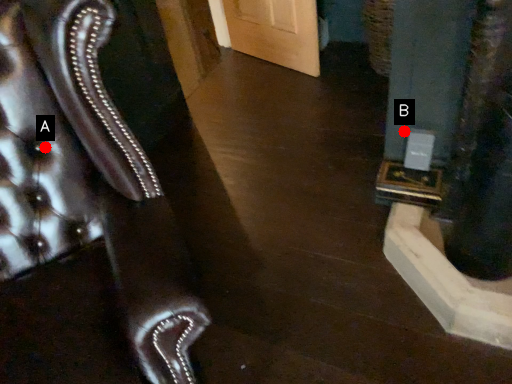
Question: Two points are circled on the image, labeled by A and B beside each circle. Among these points, which one is farthest from the camera?

Choices:
 (A) A is further
 (B) B is further

Answer: (B)